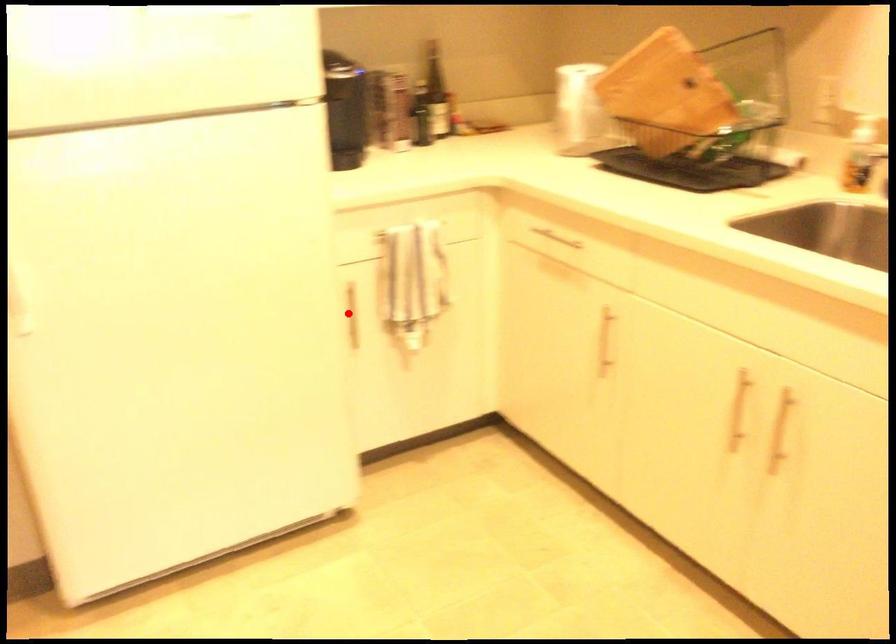
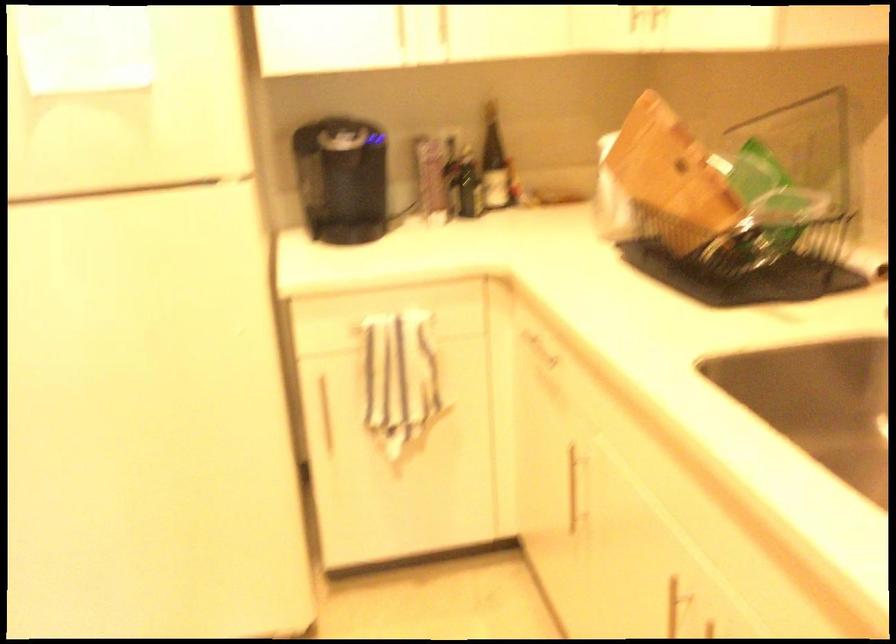
Question: A red point is marked in image1. In image2, is the corresponding 3D point closer to the camera or farther? Reply with the corresponding letter.

Choices:
 (A) The corresponding 3D point is closer.
 (B) The corresponding 3D point is farther.

Answer: (A)